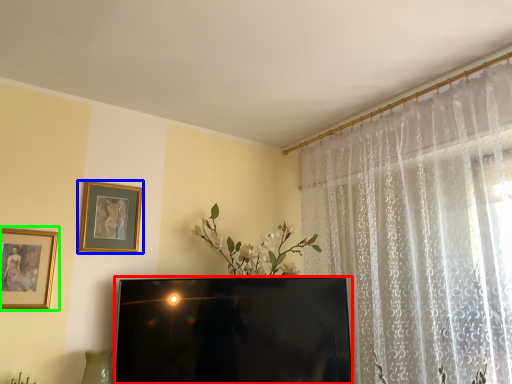
Question: Based on their relative distances, which object is nearer to television (highlighted by a red box)? Choose from picture frame (highlighted by a blue box) and picture frame (highlighted by a green box).

Choices:
 (A) picture frame
 (B) picture frame

Answer: (A)